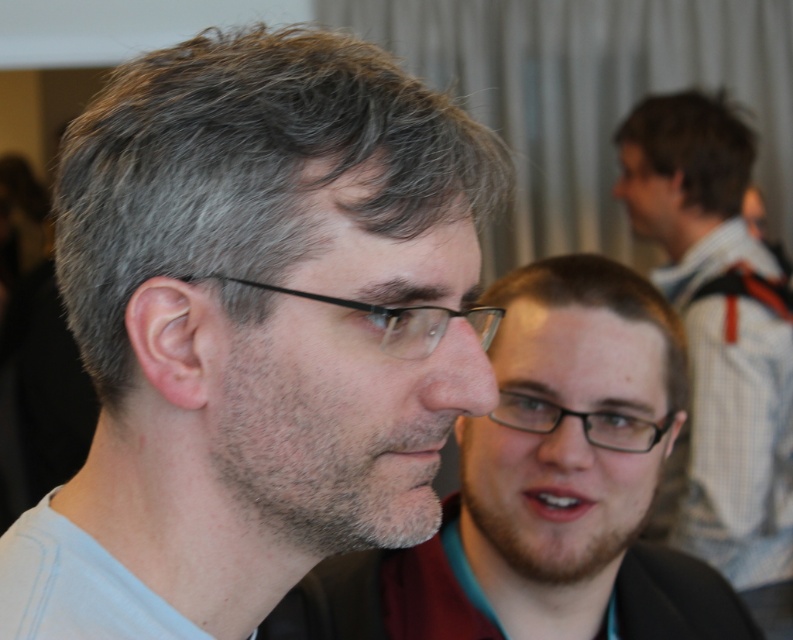
You are a photographer trying to adjust the focus of your camera. You want to focus on the black plastic glasses at center without blurring the dark brown hair at upper right. Is this possible given their positions?

The black plastic glasses at center is behind dark brown hair at upper right, so focusing on the black plastic glasses at center would likely blur the dark brown hair at upper right due to their positional relationship.

You are a photographer trying to capture a portrait of both the light brown hair at right and the dark brown hair at upper right. Which hair should you focus on to ensure both are in focus?

To ensure both the light brown hair at right and the dark brown hair at upper right are in focus, focus on the light brown hair at right since it is closer to the viewer, allowing the dark brown hair at upper right to be within the depth of field.

Based on the scene description, which object is taller between the light brown hair at right and the black plastic glasses at left?

The light brown hair at right is taller than the black plastic glasses at left according to the description.